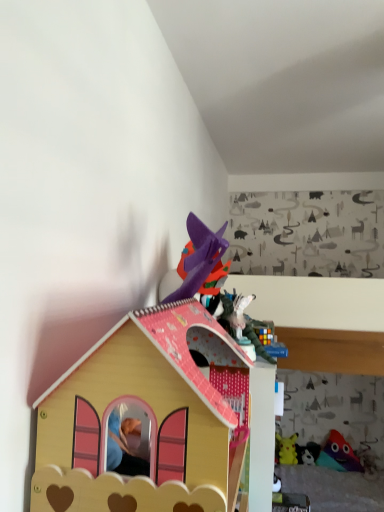
What do you see at coordinates (147, 418) in the screenshot? I see `wooden dollhouse at center, acting as the 1th toy starting from the left` at bounding box center [147, 418].

I want to click on multicolored plush toy at lower right, the 4th toy positioned from the left, so click(338, 454).

Find the location of a particular element. white matte plush toy at lower right, which ranks as the second toy in back-to-front order is located at coordinates (308, 453).

You are a GUI agent. You are given a task and a screenshot of the screen. Output one action in this format:
    pyautogui.click(x=<x>, y=<y>)
    Task: Click on the wooden dollhouse at center, the fifth toy from the bottom
    
    Given the screenshot: What is the action you would take?
    point(147,418)

Between multicolored plush toy at lower right, positioned as the 4th toy in bottom-to-top order, and rubber duck at lower right, which appears as the 2th toy when viewed from the front, which one has smaller width?

Thinner between the two is multicolored plush toy at lower right, positioned as the 4th toy in bottom-to-top order.

Is multicolored plush toy at lower right, marked as the second toy in a top-to-bottom arrangement, located outside rubber duck at lower right, the 1th toy positioned from the bottom?

multicolored plush toy at lower right, marked as the second toy in a top-to-bottom arrangement, is positioned outside rubber duck at lower right, the 1th toy positioned from the bottom.

From a real-world perspective, between multicolored plush toy at lower right, acting as the second toy starting from the right, and rubber duck at lower right, the first toy when ordered from right to left, who is vertically lower?

rubber duck at lower right, the first toy when ordered from right to left, is physically lower.

Consider the image. Which point is more distant from viewer, (343, 458) or (371, 460)?

The point (371, 460) is behind.

Consider the image. Does white matte plush toy at lower right, arranged as the third toy when viewed from the right, come in front of yellow plush toy at upper right, marked as the 5th toy in a front-to-back arrangement?

Yes, white matte plush toy at lower right, arranged as the third toy when viewed from the right, is closer to the camera.

Based on the photo, which of these two, white matte plush toy at lower right, placed as the 2th toy when sorted from bottom to top, or yellow plush toy at upper right, marked as the 1th toy in a back-to-front arrangement, stands taller?

Standing taller between the two is yellow plush toy at upper right, marked as the 1th toy in a back-to-front arrangement.

From a real-world perspective, count 1st toys downward from the yellow plush toy at upper right, marked as the 5th toy in a front-to-back arrangement, and point to it. Please provide its 2D coordinates.

[(308, 453)]

Could you tell me if multicolored plush toy at lower right, the 3th toy viewed from the front, is facing white matte plush toy at lower right, acting as the 4th toy starting from the front?

No, multicolored plush toy at lower right, the 3th toy viewed from the front, is not aimed at white matte plush toy at lower right, acting as the 4th toy starting from the front.

Is multicolored plush toy at lower right, the 4th toy positioned from the left, next to white matte plush toy at lower right, placed as the 2th toy when sorted from bottom to top?

No, multicolored plush toy at lower right, the 4th toy positioned from the left, is not next to white matte plush toy at lower right, placed as the 2th toy when sorted from bottom to top.

Does multicolored plush toy at lower right, the 3th toy viewed from the front, lie behind white matte plush toy at lower right, acting as the 4th toy starting from the front?

No, multicolored plush toy at lower right, the 3th toy viewed from the front, is in front of white matte plush toy at lower right, acting as the 4th toy starting from the front.

From a real-world perspective, who is located higher, multicolored plush toy at lower right, marked as the second toy in a top-to-bottom arrangement, or white matte plush toy at lower right, arranged as the third toy when viewed from the right?

In real-world perspective, multicolored plush toy at lower right, marked as the second toy in a top-to-bottom arrangement, is above.

Is white matte plush toy at lower right, arranged as the third toy when viewed from the right, located within rubber duck at lower right, the fourth toy in the back-to-front sequence?

No, white matte plush toy at lower right, arranged as the third toy when viewed from the right, is not inside rubber duck at lower right, the fourth toy in the back-to-front sequence.

Measure the distance between rubber duck at lower right, the 1th toy positioned from the bottom, and white matte plush toy at lower right, placed as the 2th toy when sorted from bottom to top.

rubber duck at lower right, the 1th toy positioned from the bottom, and white matte plush toy at lower right, placed as the 2th toy when sorted from bottom to top, are 12.47 inches apart from each other.

From a real-world perspective, which is physically below, rubber duck at lower right, marked as the 5th toy in a top-to-bottom arrangement, or white matte plush toy at lower right, which ranks as the second toy in back-to-front order?

rubber duck at lower right, marked as the 5th toy in a top-to-bottom arrangement, is physically lower.

Which object is thinner, rubber duck at lower right, the 1th toy positioned from the bottom, or white matte plush toy at lower right, arranged as the third toy when viewed from the right?

With smaller width is white matte plush toy at lower right, arranged as the third toy when viewed from the right.

Considering the relative positions of wooden dollhouse at center, acting as the 1th toy starting from the left, and rubber duck at lower right, the 1th toy positioned from the bottom, in the image provided, is wooden dollhouse at center, acting as the 1th toy starting from the left, to the right of rubber duck at lower right, the 1th toy positioned from the bottom, from the viewer's perspective?

Incorrect, wooden dollhouse at center, acting as the 1th toy starting from the left, is not on the right side of rubber duck at lower right, the 1th toy positioned from the bottom.

Considering the points (110, 354) and (375, 464), which point is behind, point (110, 354) or point (375, 464)?

The point (375, 464) is more distant.

Can you confirm if wooden dollhouse at center, the fifth toy from the bottom, is shorter than rubber duck at lower right, the 5th toy positioned from the left?

No.

From the picture: Is rubber duck at lower right, the first toy when ordered from right to left, to the left or to the right of wooden dollhouse at center, the 1th toy from the front, in the image?

In the image, rubber duck at lower right, the first toy when ordered from right to left, appears on the right side of wooden dollhouse at center, the 1th toy from the front.

Can you confirm if rubber duck at lower right, the 1th toy positioned from the bottom, is thinner than wooden dollhouse at center, positioned as the first toy in top-to-bottom order?

Correct, the width of rubber duck at lower right, the 1th toy positioned from the bottom, is less than that of wooden dollhouse at center, positioned as the first toy in top-to-bottom order.

Can you tell me how much rubber duck at lower right, the first toy when ordered from right to left, and wooden dollhouse at center, acting as the 1th toy starting from the left, differ in facing direction?

The facing directions of rubber duck at lower right, the first toy when ordered from right to left, and wooden dollhouse at center, acting as the 1th toy starting from the left, are 91.8 degrees apart.

From the image's perspective, starting from the white matte plush toy at lower right, arranged as the third toy when viewed from the right, which toy is the 3rd one above? Please provide its 2D coordinates.

[(147, 418)]

Is point (314, 448) more distant than point (209, 337)?

Yes, it is behind point (209, 337).

Based on the photo, could wooden dollhouse at center, the 1th toy from the front, be considered to be inside white matte plush toy at lower right, acting as the fourth toy starting from the top?

No.

In terms of width, does white matte plush toy at lower right, arranged as the third toy when viewed from the right, look wider or thinner when compared to wooden dollhouse at center, arranged as the 5th toy when viewed from the right?

Clearly, white matte plush toy at lower right, arranged as the third toy when viewed from the right, has less width compared to wooden dollhouse at center, arranged as the 5th toy when viewed from the right.

Which toy is the 1st one when counting from the front of the multicolored plush toy at lower right, positioned as the 4th toy in bottom-to-top order? Please provide its 2D coordinates.

[(367, 459)]

The height and width of the screenshot is (512, 384). What are the coordinates of `the 1st toy to the right of the yellow plush toy at upper right, marked as the 5th toy in a front-to-back arrangement, counting from the anchor's position` in the screenshot? It's located at (308, 453).

Estimate the real-world distances between objects in this image. Which object is closer to yellow plush toy at upper right, marked as the 4th toy in a right-to-left arrangement, white matte plush toy at lower right, acting as the 4th toy starting from the front, or rubber duck at lower right, the 5th toy positioned from the left?

white matte plush toy at lower right, acting as the 4th toy starting from the front, lies closer to yellow plush toy at upper right, marked as the 4th toy in a right-to-left arrangement, than the other object.

Estimate the real-world distances between objects in this image. Which object is closer to yellow plush toy at upper right, marked as the 5th toy in a front-to-back arrangement, rubber duck at lower right, the 1th toy positioned from the bottom, or wooden dollhouse at center, the fifth toy in the back-to-front sequence?

rubber duck at lower right, the 1th toy positioned from the bottom.

From the image, which object appears to be farther from rubber duck at lower right, the first toy when ordered from right to left, yellow plush toy at upper right, placed as the 3th toy when sorted from top to bottom, or wooden dollhouse at center, arranged as the 5th toy when viewed from the right?

wooden dollhouse at center, arranged as the 5th toy when viewed from the right, lies further to rubber duck at lower right, the first toy when ordered from right to left, than the other object.

Estimate the real-world distances between objects in this image. Which object is closer to rubber duck at lower right, marked as the 5th toy in a top-to-bottom arrangement, white matte plush toy at lower right, acting as the fourth toy starting from the top, or yellow plush toy at upper right, the 3th toy ordered from the bottom?

Among the two, white matte plush toy at lower right, acting as the fourth toy starting from the top, is located nearer to rubber duck at lower right, marked as the 5th toy in a top-to-bottom arrangement.

Looking at the image, which one is located further to wooden dollhouse at center, acting as the 1th toy starting from the left, rubber duck at lower right, marked as the 5th toy in a top-to-bottom arrangement, or multicolored plush toy at lower right, marked as the second toy in a top-to-bottom arrangement?

rubber duck at lower right, marked as the 5th toy in a top-to-bottom arrangement, is positioned further to the anchor wooden dollhouse at center, acting as the 1th toy starting from the left.

From the image, which object appears to be farther from yellow plush toy at upper right, the 3th toy ordered from the bottom, multicolored plush toy at lower right, positioned as the third toy in back-to-front order, or white matte plush toy at lower right, acting as the 4th toy starting from the front?

The object further to yellow plush toy at upper right, the 3th toy ordered from the bottom, is multicolored plush toy at lower right, positioned as the third toy in back-to-front order.

Looking at the image, which one is located closer to yellow plush toy at upper right, marked as the 5th toy in a front-to-back arrangement, white matte plush toy at lower right, positioned as the 3th toy in left-to-right order, or multicolored plush toy at lower right, marked as the second toy in a top-to-bottom arrangement?

The object closer to yellow plush toy at upper right, marked as the 5th toy in a front-to-back arrangement, is white matte plush toy at lower right, positioned as the 3th toy in left-to-right order.

Looking at this image, estimate the real-world distances between objects in this image. Which object is further from multicolored plush toy at lower right, the 3th toy viewed from the front, yellow plush toy at upper right, the 3th toy ordered from the bottom, or rubber duck at lower right, marked as the 5th toy in a top-to-bottom arrangement?

yellow plush toy at upper right, the 3th toy ordered from the bottom, is further to multicolored plush toy at lower right, the 3th toy viewed from the front.

Where is `toy between wooden dollhouse at center, positioned as the first toy in top-to-bottom order, and multicolored plush toy at lower right, acting as the second toy starting from the right, along the z-axis`? Image resolution: width=384 pixels, height=512 pixels. toy between wooden dollhouse at center, positioned as the first toy in top-to-bottom order, and multicolored plush toy at lower right, acting as the second toy starting from the right, along the z-axis is located at coordinates (367, 459).

Where is `toy between white matte plush toy at lower right, positioned as the 3th toy in left-to-right order, and rubber duck at lower right, which appears as the 2th toy when viewed from the front`? The width and height of the screenshot is (384, 512). toy between white matte plush toy at lower right, positioned as the 3th toy in left-to-right order, and rubber duck at lower right, which appears as the 2th toy when viewed from the front is located at coordinates (338, 454).

Find the location of a particular element. toy located between yellow plush toy at upper right, marked as the 1th toy in a back-to-front arrangement, and multicolored plush toy at lower right, positioned as the third toy in back-to-front order, in the left-right direction is located at coordinates (308, 453).